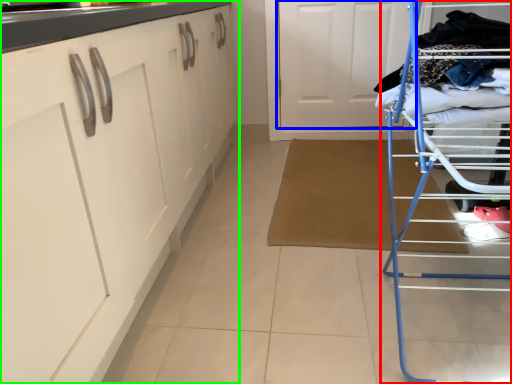
Question: Considering the real-world distances, which object is closest to furniture (highlighted by a red box)? door (highlighted by a blue box) or cabinetry (highlighted by a green box).

Choices:
 (A) door
 (B) cabinetry

Answer: (B)